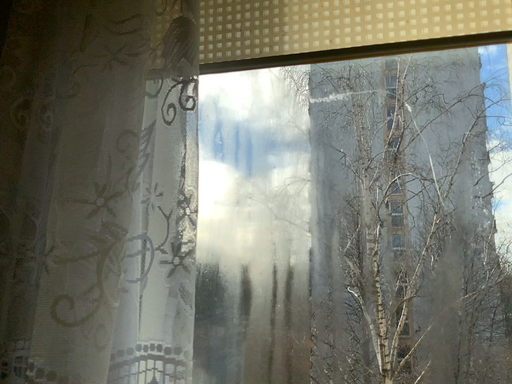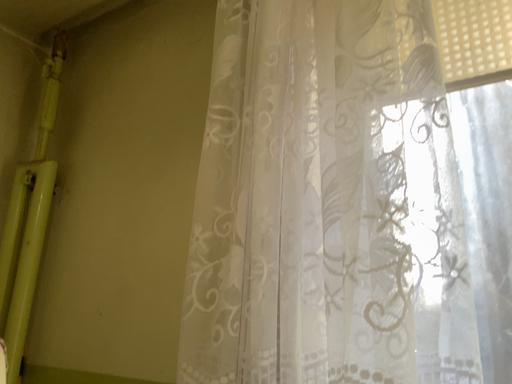
Question: How did the camera likely rotate when shooting the video?

Choices:
 (A) rotated right
 (B) rotated left

Answer: (B)